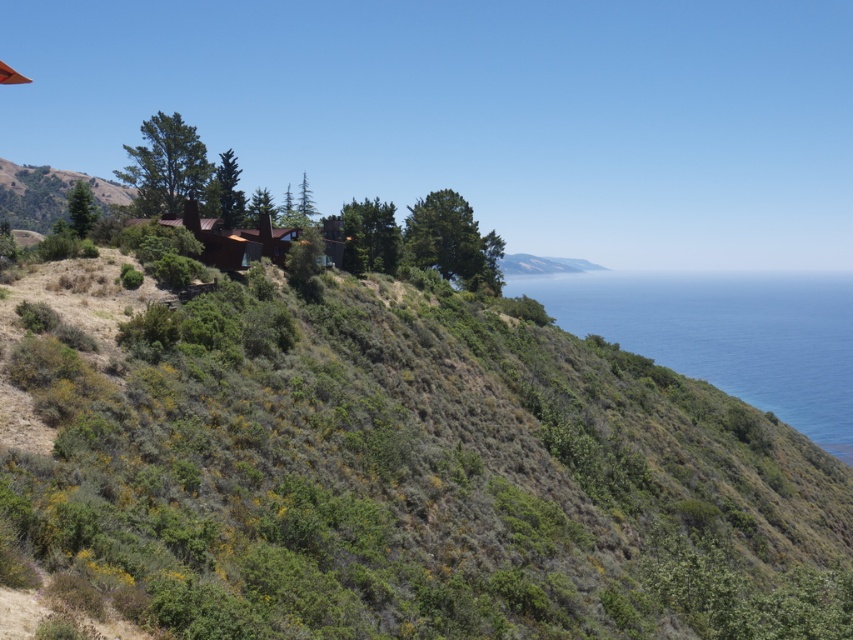
You are a drone operator planning to fly a drone from the green shrubbery at upper center to the blue water at right. Considering the height difference between these two locations, will the drone need to ascend or descend to reach its destination?

The green shrubbery at upper center is not as tall as blue water at right, so the drone will need to ascend to reach the blue water at right.

You are standing at the top of the steep, grassy hillside and want to walk down to the blue water at right. However, you notice the green shrubbery at upper center. Based on the scene, which direction should you avoid to reach the water safely?

The green shrubbery at upper center is positioned over the blue water at right, so you should avoid going towards the green shrubbery at upper center as it is above the water and may be unstable or steep. Instead, head towards the right side of the hill where the slope gently leads down to the blue water at right.